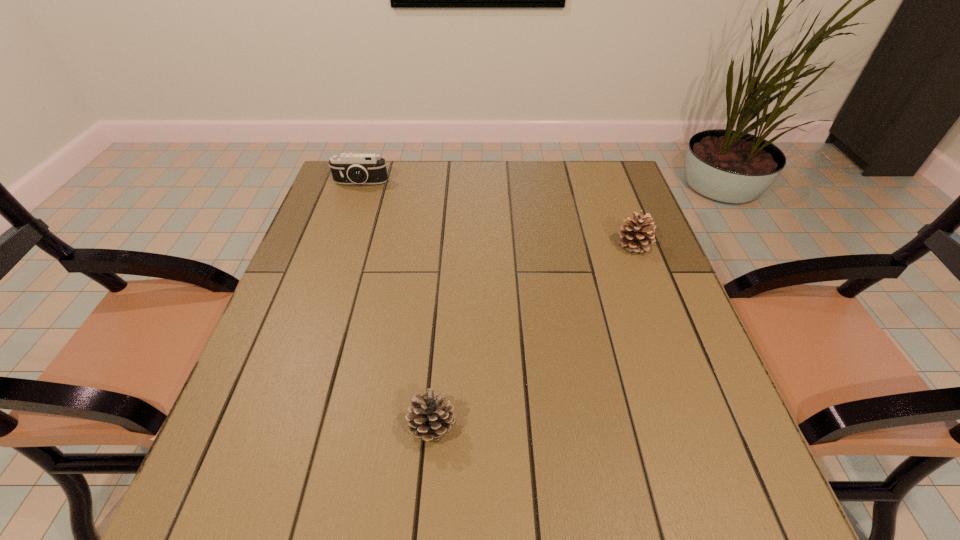
This screenshot has width=960, height=540. Identify the location of object that is positioned at the left edge. (350, 168).

Find the location of a particular element. This screenshot has width=960, height=540. object situated at the right edge is located at coordinates (636, 237).

Where is `object that is at the far left corner`? The width and height of the screenshot is (960, 540). object that is at the far left corner is located at coordinates (350, 168).

Find the location of a particular element. This screenshot has height=540, width=960. blank area at the far edge is located at coordinates click(530, 167).

This screenshot has width=960, height=540. I want to click on free space at the near edge of the desktop, so click(518, 482).

In the image, there is a desktop. In order to click on free space at the left edge in this screenshot , I will do `click(288, 379)`.

This screenshot has width=960, height=540. What are the coordinates of `vacant area at the right edge of the desktop` in the screenshot? It's located at (588, 225).

Locate an element on the screen. Image resolution: width=960 pixels, height=540 pixels. vacant space at the far left corner is located at coordinates (380, 187).

This screenshot has width=960, height=540. I want to click on free space at the near right corner of the desktop, so click(x=740, y=485).

Image resolution: width=960 pixels, height=540 pixels. I want to click on vacant point located between the camera and the second object from right to left, so click(x=396, y=305).